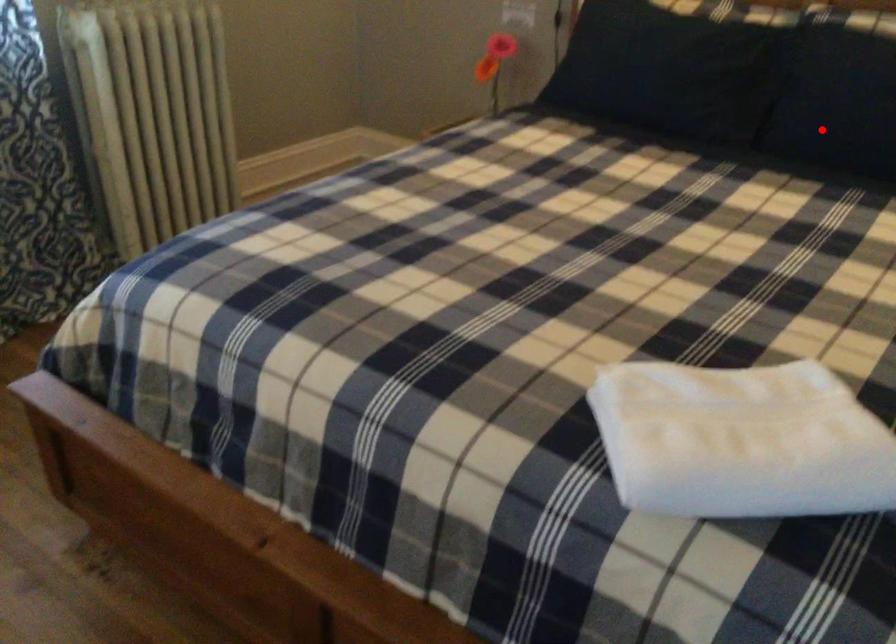
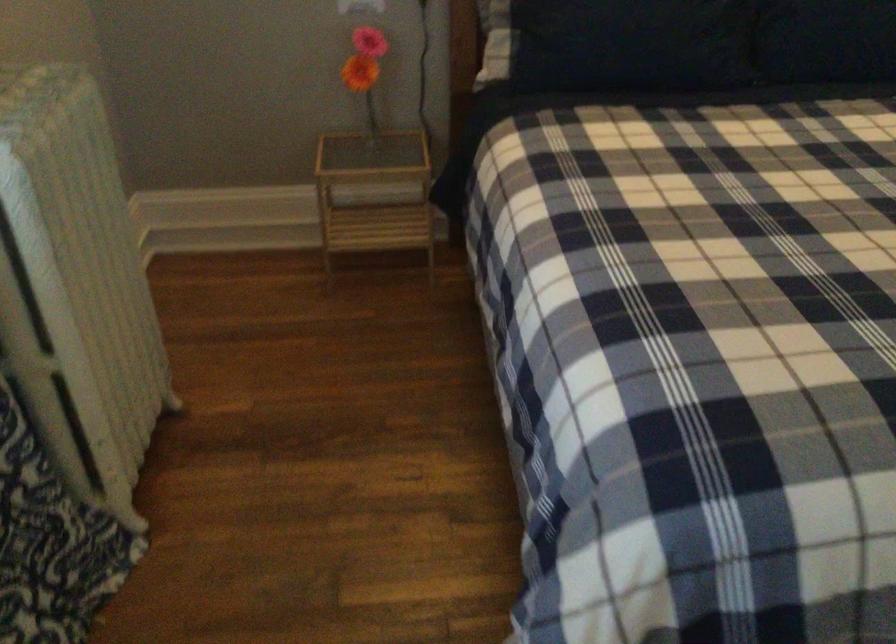
In the second image, find the point that corresponds to the highlighted location in the first image.

(830, 43)